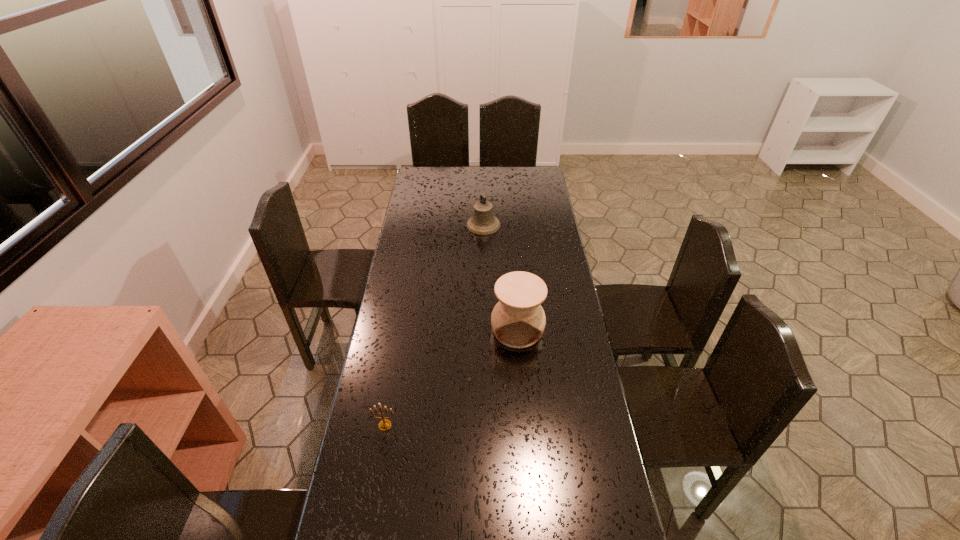
What are the coordinates of `the tallest object` in the screenshot? It's located at (518, 320).

This screenshot has height=540, width=960. I want to click on pottery, so click(x=518, y=320).

The height and width of the screenshot is (540, 960). I want to click on bell, so click(x=483, y=222).

Find the location of a particular element. The width and height of the screenshot is (960, 540). the second tallest object is located at coordinates (483, 222).

Where is `candelabrum`? The height and width of the screenshot is (540, 960). candelabrum is located at coordinates (385, 424).

Where is `the shortest object`? The width and height of the screenshot is (960, 540). the shortest object is located at coordinates (385, 424).

This screenshot has height=540, width=960. Find the location of `vacant space located at the open side of the second nearest object`. vacant space located at the open side of the second nearest object is located at coordinates (527, 450).

Identify the location of vacant space located 0.080m on the left of the bell. The image size is (960, 540). (450, 225).

In order to click on vacant region located 0.190m on the right of the nearest object in this screenshot , I will do `click(459, 425)`.

The width and height of the screenshot is (960, 540). I want to click on object present at the left edge, so click(385, 424).